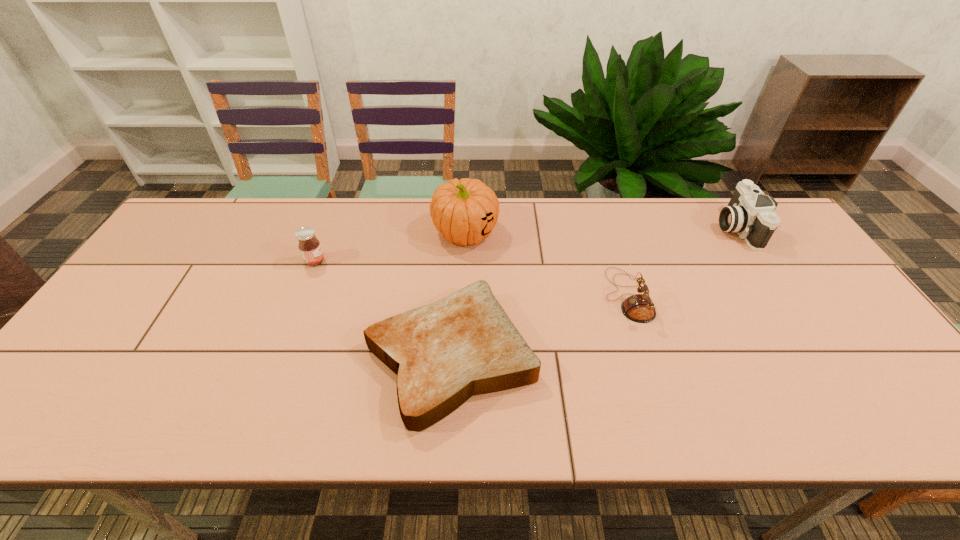
At what (x,y) coordinates should I click in order to perform the action: click on vacant space at the far edge. Please return your answer as a coordinate pair (x, y). The width and height of the screenshot is (960, 540). Looking at the image, I should click on (499, 231).

Where is `free space at the left edge of the desktop`? This screenshot has width=960, height=540. free space at the left edge of the desktop is located at coordinates (163, 260).

This screenshot has width=960, height=540. What are the coordinates of `free space at the far left corner of the desktop` in the screenshot? It's located at (213, 238).

You are a GUI agent. You are given a task and a screenshot of the screen. Output one action in this format:
    pyautogui.click(x=<x>, y=<y>)
    Task: Click on the free area in between the tallest object and the jam
    
    Given the screenshot: What is the action you would take?
    pyautogui.click(x=390, y=247)

I want to click on vacant region between the shortest object and the rightmost object, so click(593, 292).

At what (x,y) coordinates should I click in order to perform the action: click on free point between the fourth tallest object and the rightmost object. Please return your answer as a coordinate pair (x, y). Looking at the image, I should click on (682, 261).

Locate an element on the screen. This screenshot has height=540, width=960. free spot between the telephone and the bread is located at coordinates (540, 326).

At what (x,y) coordinates should I click in order to perform the action: click on free space between the telephone and the tallest object. Please return your answer as a coordinate pair (x, y). Looking at the image, I should click on (546, 264).

This screenshot has height=540, width=960. Identify the location of free space between the tallest object and the telephone. (546, 264).

Identify the location of vacant area that lies between the fourth tallest object and the leftmost object. (471, 279).